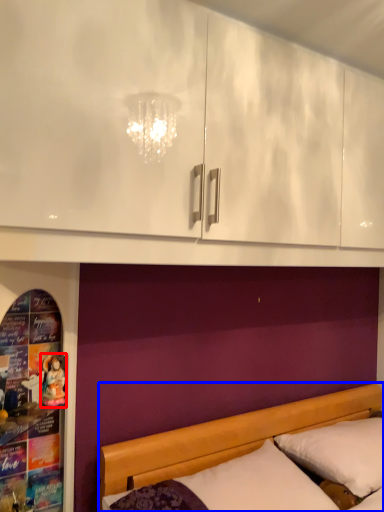
Question: Which object appears farthest to the camera in this image, doll (highlighted by a red box) or bed (highlighted by a blue box)?

Choices:
 (A) doll
 (B) bed

Answer: (A)